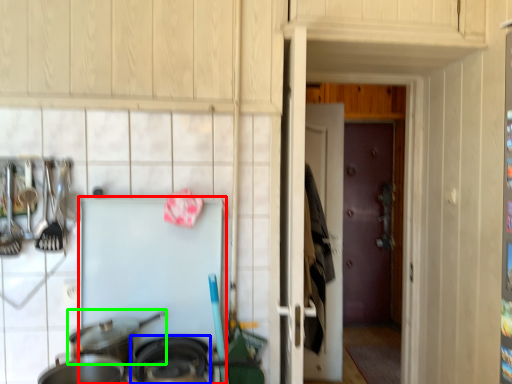
Question: Estimate the real-world distances between objects in this image. Which object is farther from appliance (highlighted by a red box), wok (highlighted by a blue box) or wok (highlighted by a green box)?

Choices:
 (A) wok
 (B) wok

Answer: (A)